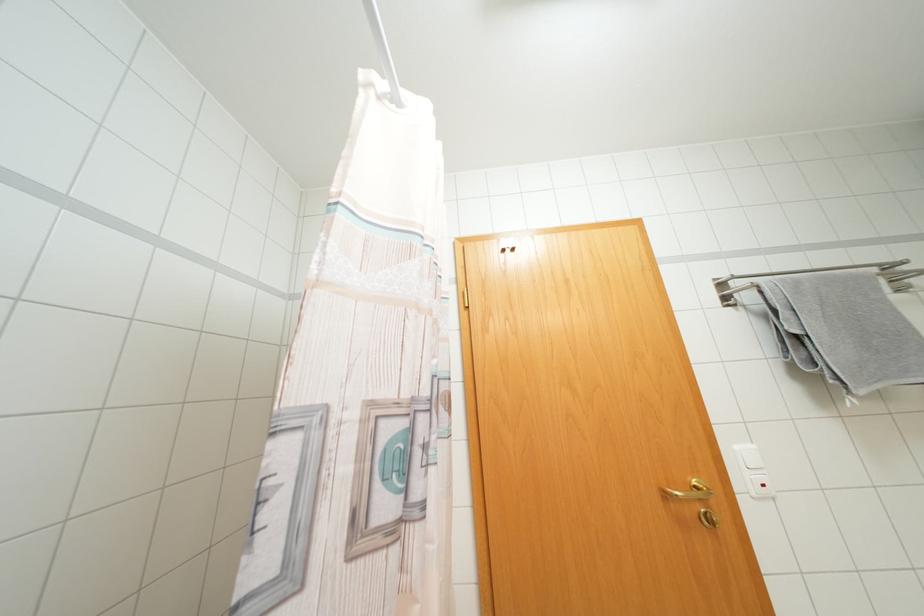
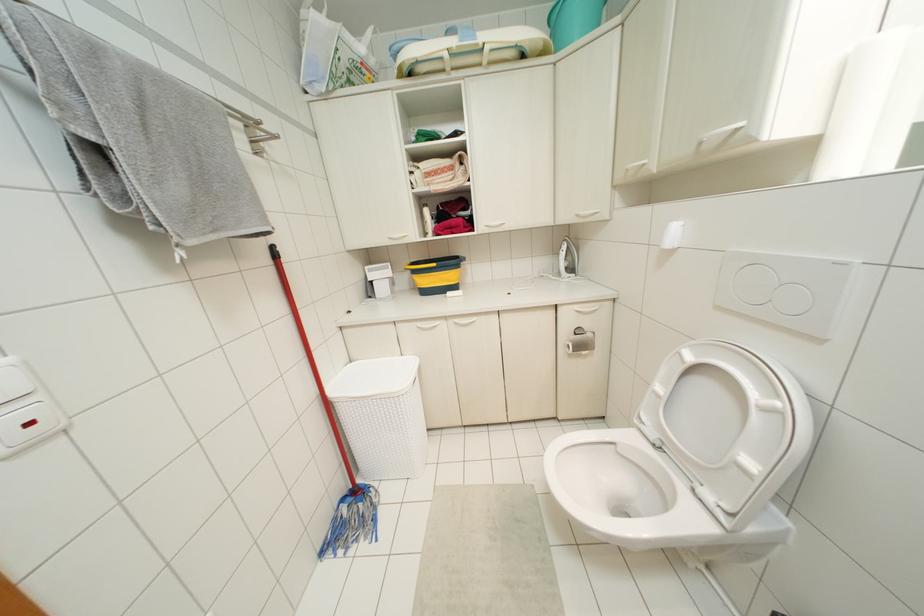
Where in the second image is the point corresponding to the point at 754,446 from the first image?

(7, 360)